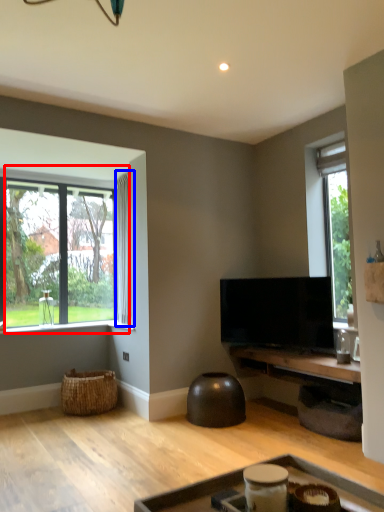
Question: Which object is further to the camera taking this photo, window (highlighted by a red box) or curtain (highlighted by a blue box)?

Choices:
 (A) window
 (B) curtain

Answer: (B)